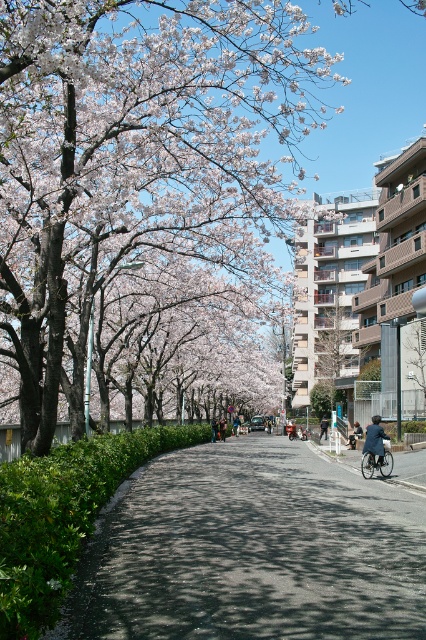
Question: Does metallic silver bicycle at center appear under dark blue jacket at center?

Choices:
 (A) no
 (B) yes

Answer: (A)

Question: Which of these objects is positioned farthest from the smooth pink blossoms at center?

Choices:
 (A) metallic silver bicycle at center
 (B) green fabric jacket at center
 (C) denim jacket at center
 (D) dark blue jacket at center

Answer: (C)

Question: Is green fabric jacket at center above denim jacket at center?

Choices:
 (A) yes
 (B) no

Answer: (A)

Question: Which object is positioned farthest from the smooth pink blossoms at center?

Choices:
 (A) dark blue jacket at center
 (B) denim jacket at center
 (C) green fabric jacket at center

Answer: (B)

Question: Observing the image, what is the correct spatial positioning of smooth pink blossoms at center in reference to dark blue jacket at center?

Choices:
 (A) right
 (B) left

Answer: (B)

Question: Which point is farther from the camera taking this photo?

Choices:
 (A) (235, 422)
 (B) (219, 419)

Answer: (B)